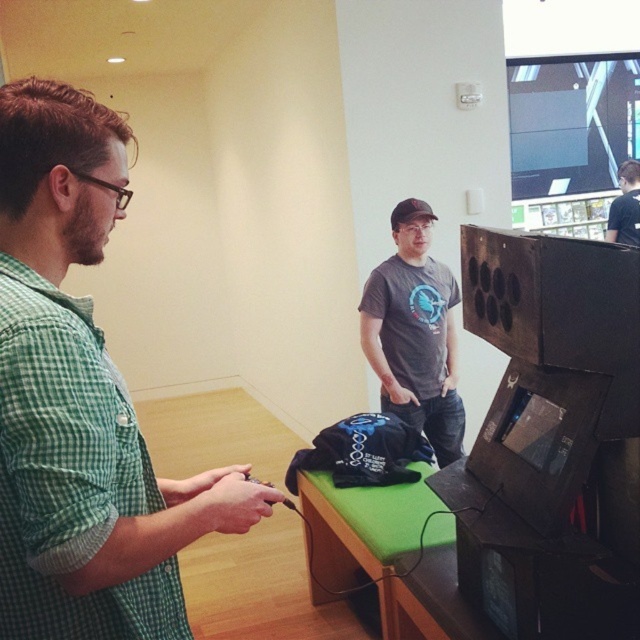
You are a photographer positioned at the back of the room. You want to take a photo of both the green checkered shirt at left and the black matte shirt at center. Which person should you focus on first to ensure both are in focus?

You should focus on the green checkered shirt at left first because it is closer to the viewer than the black matte shirt at center, so adjusting focus from near to far will help both be in focus.